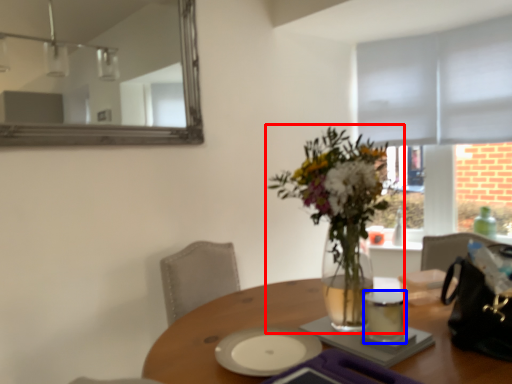
Question: Which of the following is the farthest to the observer, houseplant (highlighted by a red box) or tableware (highlighted by a blue box)?

Choices:
 (A) houseplant
 (B) tableware

Answer: (B)